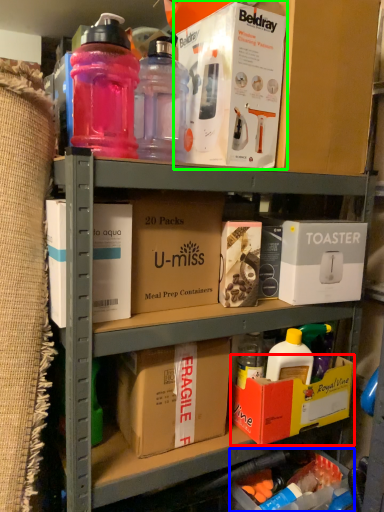
Question: Based on their relative distances, which object is nearer to box (highlighted by a red box)? Choose from box (highlighted by a blue box) and box (highlighted by a green box).

Choices:
 (A) box
 (B) box

Answer: (A)